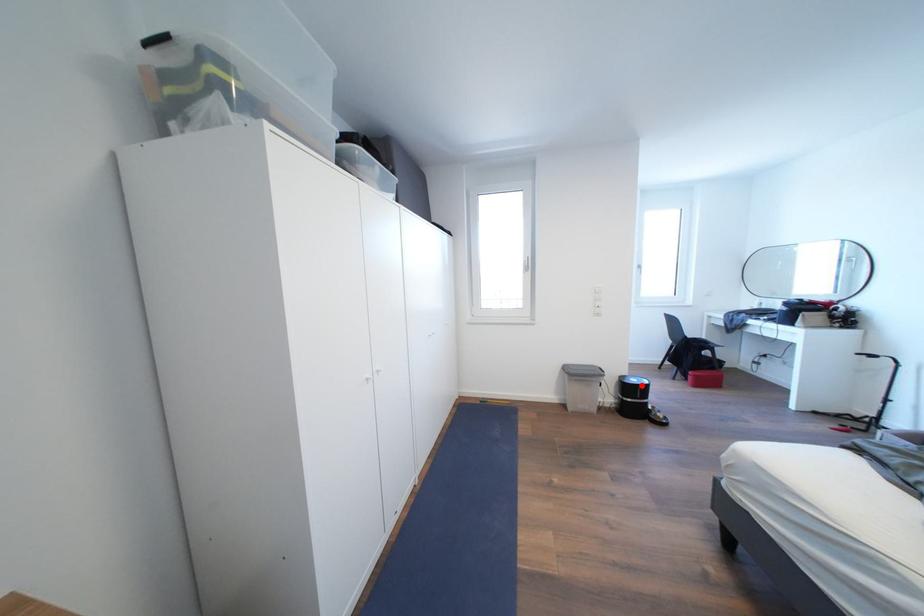
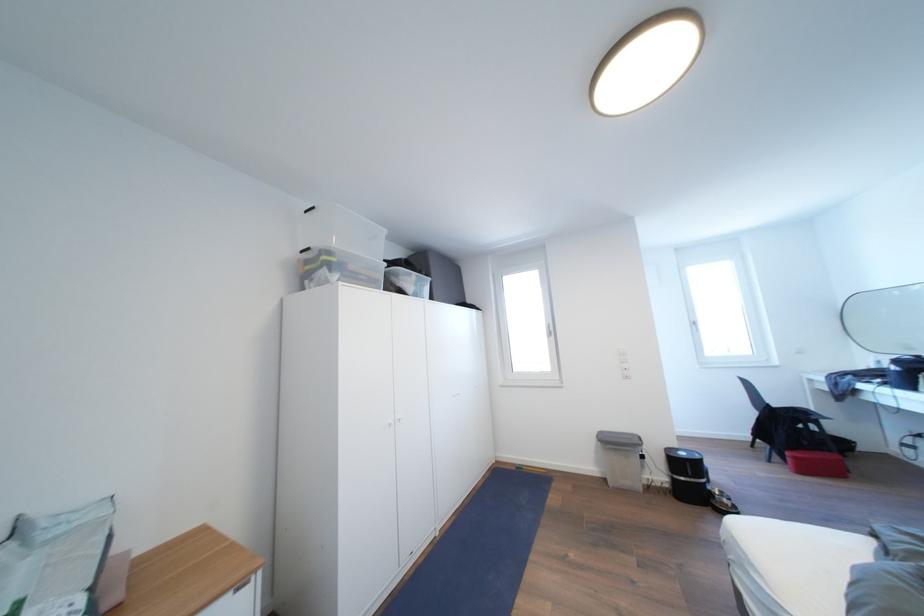
Find the pixel in the second image that matches the highlighted location in the first image.

(689, 459)